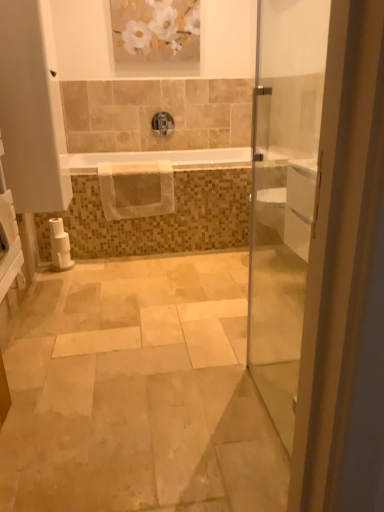
Question: Considering the relative sizes of white glossy bathtub at center and satin nickel faucet at upper center in the image provided, is white glossy bathtub at center wider than satin nickel faucet at upper center?

Choices:
 (A) no
 (B) yes

Answer: (B)

Question: Is white glossy bathtub at center positioned before satin nickel faucet at upper center?

Choices:
 (A) yes
 (B) no

Answer: (A)

Question: Is white glossy bathtub at center not inside satin nickel faucet at upper center?

Choices:
 (A) yes
 (B) no

Answer: (A)

Question: Is white glossy bathtub at center far from satin nickel faucet at upper center?

Choices:
 (A) no
 (B) yes

Answer: (A)

Question: Does white glossy bathtub at center have a lesser width compared to satin nickel faucet at upper center?

Choices:
 (A) no
 (B) yes

Answer: (A)

Question: From a real-world perspective, is white glossy bathtub at center positioned over satin nickel faucet at upper center based on gravity?

Choices:
 (A) no
 (B) yes

Answer: (A)

Question: Can you confirm if white glossy door at right is smaller than satin nickel faucet at upper center?

Choices:
 (A) yes
 (B) no

Answer: (B)

Question: Is white glossy door at right placed right next to satin nickel faucet at upper center?

Choices:
 (A) yes
 (B) no

Answer: (B)

Question: Is white glossy door at right aimed at satin nickel faucet at upper center?

Choices:
 (A) no
 (B) yes

Answer: (A)

Question: Is white glossy door at right outside of satin nickel faucet at upper center?

Choices:
 (A) yes
 (B) no

Answer: (A)

Question: Considering the relative sizes of white glossy door at right and satin nickel faucet at upper center in the image provided, is white glossy door at right shorter than satin nickel faucet at upper center?

Choices:
 (A) no
 (B) yes

Answer: (A)

Question: Considering the relative sizes of white glossy door at right and satin nickel faucet at upper center in the image provided, is white glossy door at right thinner than satin nickel faucet at upper center?

Choices:
 (A) no
 (B) yes

Answer: (B)

Question: From the image's perspective, would you say white matte painting at upper center is positioned over white glossy bathtub at center?

Choices:
 (A) yes
 (B) no

Answer: (A)